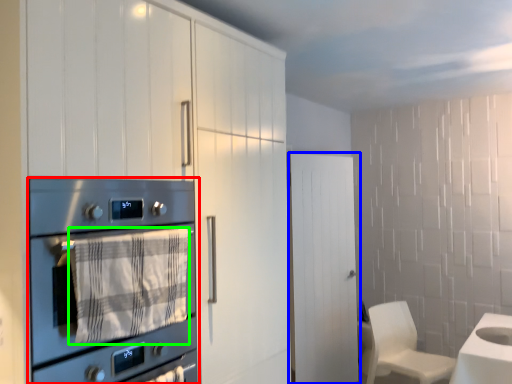
Question: Which object is positioned farthest from home appliance (highlighted by a red box)? Select from door (highlighted by a blue box) and blanket (highlighted by a green box).

Choices:
 (A) door
 (B) blanket

Answer: (A)